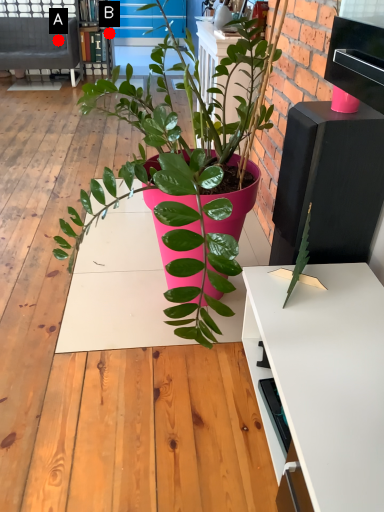
Question: Two points are circled on the image, labeled by A and B beside each circle. Which point is further to the camera?

Choices:
 (A) A is further
 (B) B is further

Answer: (A)